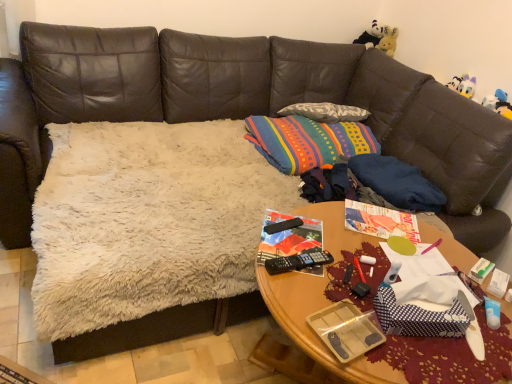
What are the coordinates of `vacant space positioned to the left of clear plastic tray at center` in the screenshot? It's located at (290, 309).